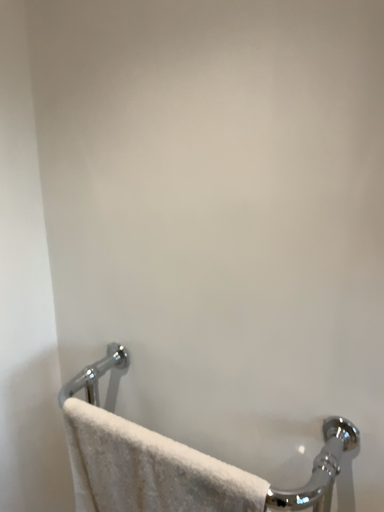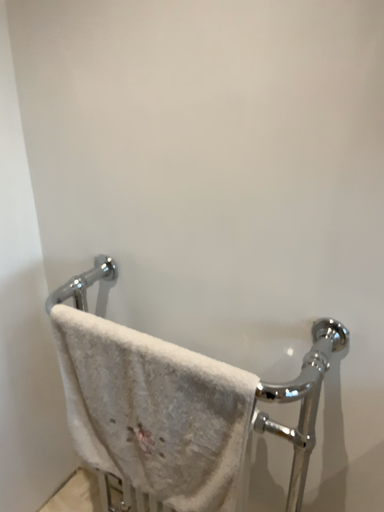
Question: Which way did the camera rotate in the video?

Choices:
 (A) rotated upward
 (B) rotated downward

Answer: (B)